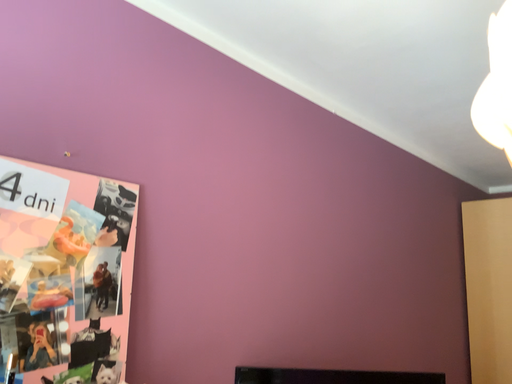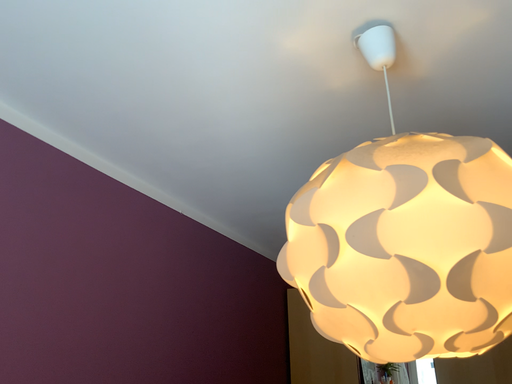
Question: How did the camera likely rotate when shooting the video?

Choices:
 (A) rotated upward
 (B) rotated downward

Answer: (A)